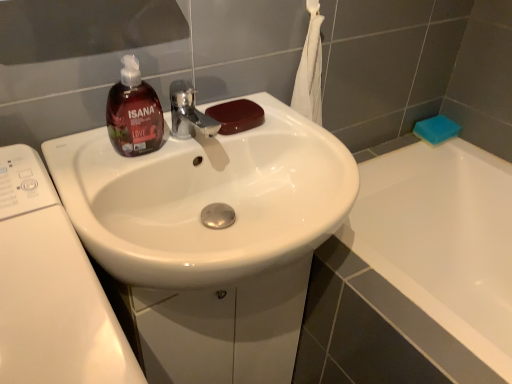
Question: Is blue sponge at upper right, the 1th soap from the right, facing towards white glossy sink at center?

Choices:
 (A) yes
 (B) no

Answer: (A)

Question: Considering the relative sizes of blue sponge at upper right, placed as the 1th soap when sorted from back to front, and white glossy sink at center in the image provided, is blue sponge at upper right, placed as the 1th soap when sorted from back to front, shorter than white glossy sink at center?

Choices:
 (A) no
 (B) yes

Answer: (B)

Question: From the image's perspective, is blue sponge at upper right, acting as the second soap starting from the front, on white glossy sink at center?

Choices:
 (A) yes
 (B) no

Answer: (A)

Question: Considering the relative sizes of blue sponge at upper right, which appears as the 2th soap when viewed from the left, and white glossy sink at center in the image provided, is blue sponge at upper right, which appears as the 2th soap when viewed from the left, wider than white glossy sink at center?

Choices:
 (A) no
 (B) yes

Answer: (A)

Question: From a real-world perspective, is blue sponge at upper right, placed as the 1th soap when sorted from back to front, positioned under white glossy sink at center based on gravity?

Choices:
 (A) no
 (B) yes

Answer: (B)

Question: In the image, is brown glossy soap at sink, which is the 1th soap in front-to-back order, positioned in front of or behind white glossy washing machine at left?

Choices:
 (A) behind
 (B) front

Answer: (A)

Question: From a real-world perspective, relative to white glossy washing machine at left, is brown glossy soap at sink, placed as the first soap when sorted from left to right, vertically above or below?

Choices:
 (A) below
 (B) above

Answer: (B)

Question: Looking at their shapes, would you say brown glossy soap at sink, placed as the first soap when sorted from left to right, is wider or thinner than white glossy washing machine at left?

Choices:
 (A) thin
 (B) wide

Answer: (A)

Question: Based on their sizes in the image, would you say brown glossy soap at sink, placed as the first soap when sorted from left to right, is bigger or smaller than white glossy washing machine at left?

Choices:
 (A) small
 (B) big

Answer: (A)

Question: From a real-world perspective, is white glossy washing machine at left above or below white glossy sink at center?

Choices:
 (A) below
 (B) above

Answer: (A)

Question: Considering the positions of white glossy washing machine at left and white glossy sink at center in the image, is white glossy washing machine at left bigger or smaller than white glossy sink at center?

Choices:
 (A) big
 (B) small

Answer: (A)

Question: Considering the relative positions of white glossy washing machine at left and white glossy sink at center in the image provided, is white glossy washing machine at left to the left or to the right of white glossy sink at center?

Choices:
 (A) left
 (B) right

Answer: (A)

Question: Is white glossy washing machine at left taller or shorter than white glossy sink at center?

Choices:
 (A) tall
 (B) short

Answer: (A)

Question: Do you think white glossy sink at center is within brown glossy soap at sink, which is the 1th soap in front-to-back order, or outside of it?

Choices:
 (A) inside
 (B) outside

Answer: (B)

Question: Is point (268, 147) closer or farther from the camera than point (258, 104)?

Choices:
 (A) farther
 (B) closer

Answer: (A)